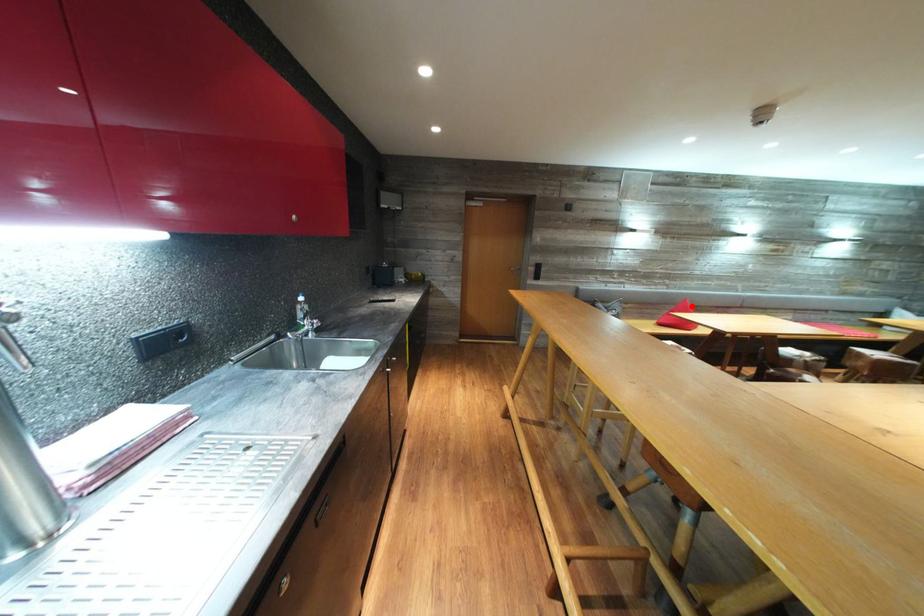
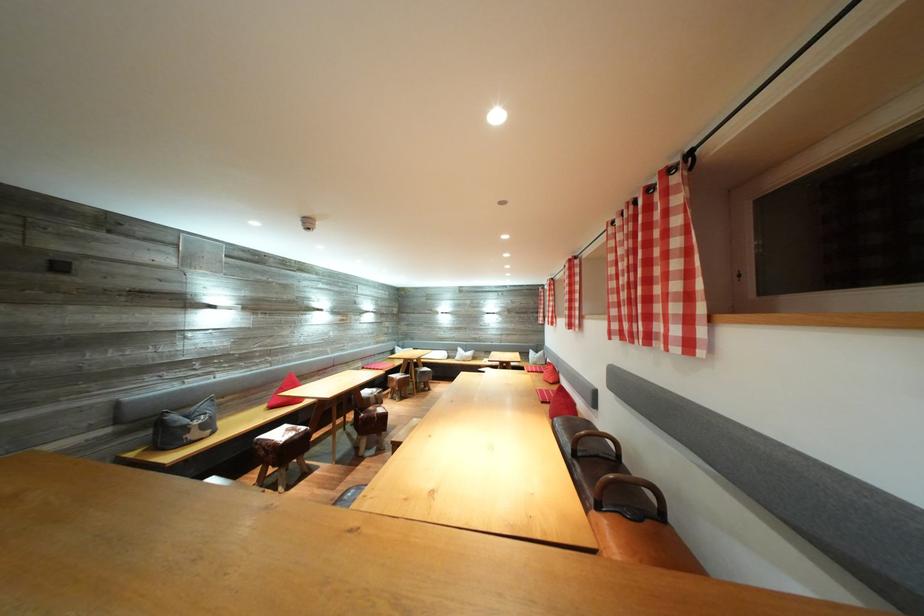
Question: A red point is marked in image1. In image2, is the corresponding 3D point closer to the camera or farther? Reply with the corresponding letter.

Choices:
 (A) The corresponding 3D point is closer.
 (B) The corresponding 3D point is farther.

Answer: (B)